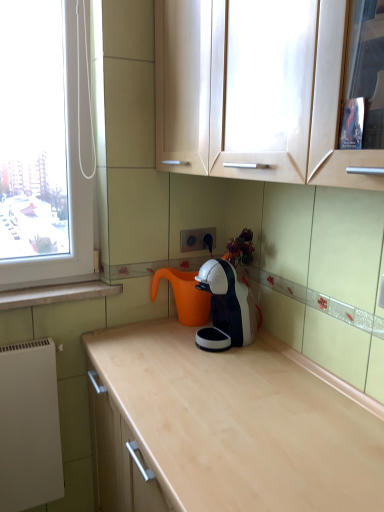
I want to click on free spot above white marble window sill at lower left (from a real-world perspective), so click(67, 273).